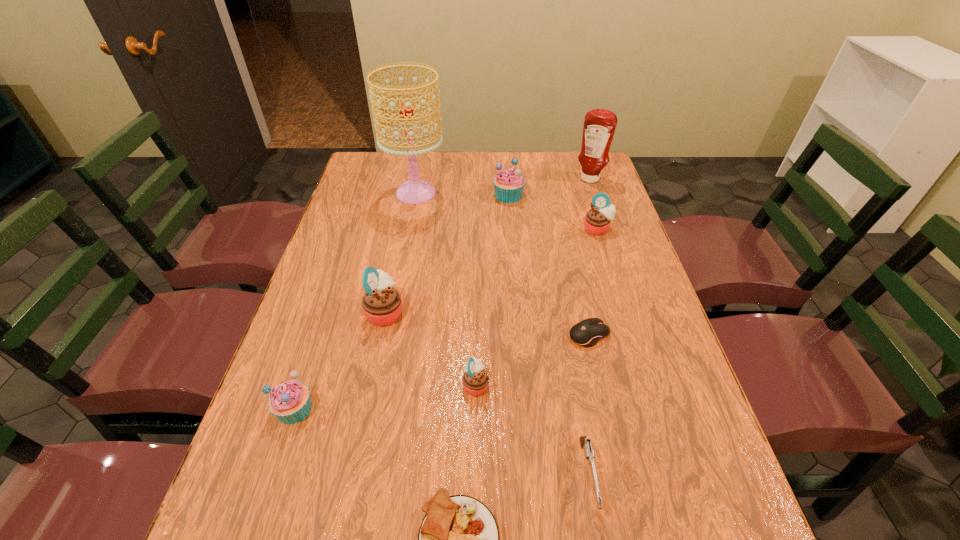
What are the coordinates of `computer mouse present at the right edge` in the screenshot? It's located at (587, 333).

Where is `object that is at the far left corner`? This screenshot has height=540, width=960. object that is at the far left corner is located at coordinates (415, 191).

In order to click on object at the far right corner in this screenshot , I will do `click(599, 126)`.

Locate an element on the screen. This screenshot has width=960, height=540. free space at the far edge is located at coordinates click(459, 158).

The width and height of the screenshot is (960, 540). Identify the location of vacant space at the left edge of the desktop. (314, 356).

You are a GUI agent. You are given a task and a screenshot of the screen. Output one action in this format:
    pyautogui.click(x=<x>, y=<y>)
    Task: Click on the free location at the right edge
    This screenshot has width=960, height=540.
    Given the screenshot: What is the action you would take?
    pyautogui.click(x=697, y=527)

Where is `vacant area at the far left corner of the desktop`? This screenshot has width=960, height=540. vacant area at the far left corner of the desktop is located at coordinates (356, 179).

Where is `vacant space that's between the lampshade and the nearest pink muffin`? The width and height of the screenshot is (960, 540). vacant space that's between the lampshade and the nearest pink muffin is located at coordinates (445, 289).

The width and height of the screenshot is (960, 540). I want to click on free space between the second muffin from left to right and the third muffin from left to right, so click(x=430, y=348).

Where is `empty space between the leftmost pink muffin and the condiment`? empty space between the leftmost pink muffin and the condiment is located at coordinates (488, 246).